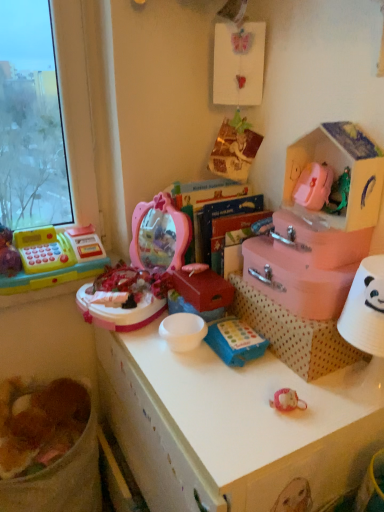
This screenshot has width=384, height=512. I want to click on vacant space that is to the left of blue fabric toy at center, the 2th toy when ordered from left to right, so click(x=160, y=358).